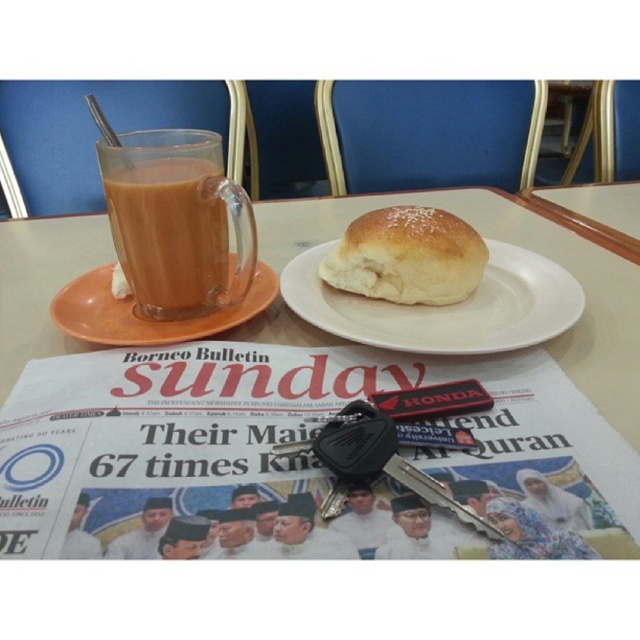
Is translucent glass mug at upper left below orange matte saucer at left?

Incorrect, translucent glass mug at upper left is not positioned below orange matte saucer at left.

The image size is (640, 640). What do you see at coordinates (177, 221) in the screenshot?
I see `translucent glass mug at upper left` at bounding box center [177, 221].

Where is `translucent glass mug at upper left`? This screenshot has height=640, width=640. translucent glass mug at upper left is located at coordinates (177, 221).

Does white glossy table at center appear on the right side of orange matte saucer at left?

Correct, you'll find white glossy table at center to the right of orange matte saucer at left.

Measure the distance from white glossy table at center to orange matte saucer at left.

white glossy table at center is 14.21 centimeters from orange matte saucer at left.

You are a GUI agent. You are given a task and a screenshot of the screen. Output one action in this format:
    pyautogui.click(x=<x>, y=<y>)
    Task: Click on the white glossy table at center
    The width and height of the screenshot is (640, 640).
    Given the screenshot: What is the action you would take?
    pyautogui.click(x=260, y=432)

Between white glossy table at center and translucent glass mug at upper left, which one appears on the right side from the viewer's perspective?

From the viewer's perspective, white glossy table at center appears more on the right side.

In the scene shown: Is white glossy table at center thinner than translucent glass mug at upper left?

In fact, white glossy table at center might be wider than translucent glass mug at upper left.

Is point (220, 412) farther from viewer compared to point (131, 260)?

No, it is not.

The image size is (640, 640). Identify the location of white glossy table at center. coord(260,432).